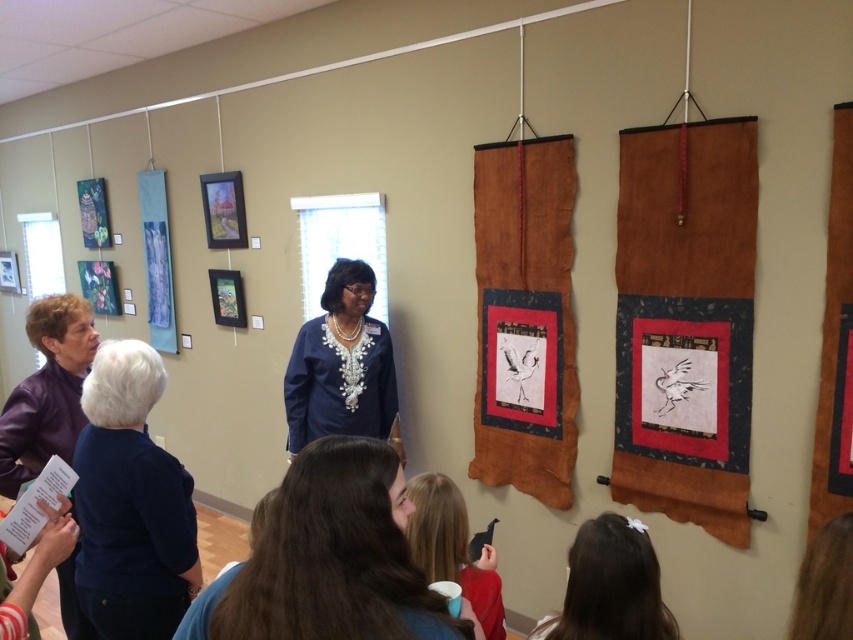
You are standing in the room and need to move from the point at coordinates point (635, 134) to the point at coordinates point (573, 184). Which direction should you move to reach your destination?

You should move backward because point (635, 134) is in front of point (573, 184), meaning the destination is behind your current position.